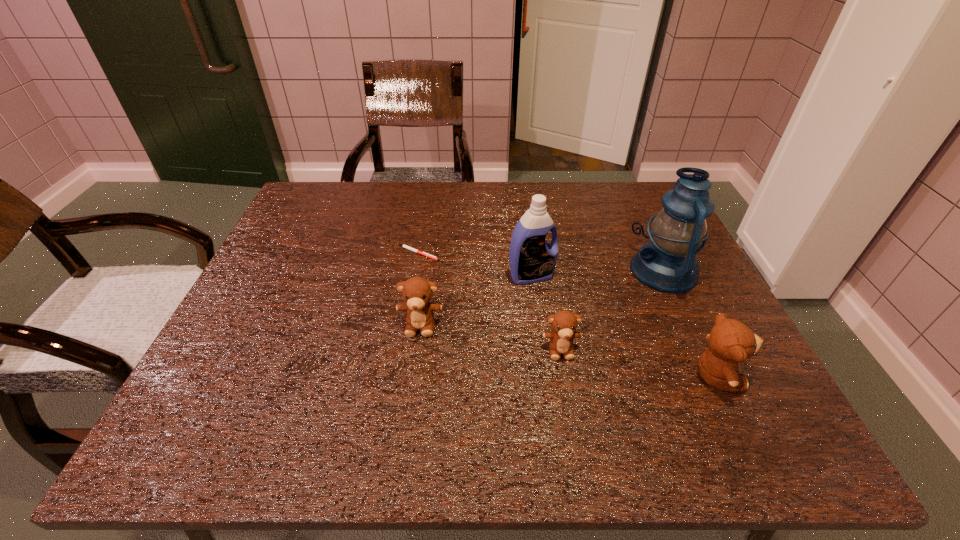
This screenshot has width=960, height=540. In order to click on vacant area between the fifth tallest object and the tallest teddy bear in this screenshot , I will do `click(638, 363)`.

What are the coordinates of `unoccupied position between the second tallest object and the second shortest teddy bear` in the screenshot? It's located at (476, 300).

This screenshot has height=540, width=960. I want to click on free spot between the second tallest object and the second shortest object, so click(546, 312).

You are a GUI agent. You are given a task and a screenshot of the screen. Output one action in this format:
    pyautogui.click(x=<x>, y=<y>)
    Task: Click on the object that is the fourth closest to the rightmost teddy bear
    
    Given the screenshot: What is the action you would take?
    pyautogui.click(x=416, y=291)

Find the location of `object that ranks as the fourth closest to the pen`. object that ranks as the fourth closest to the pen is located at coordinates (668, 263).

Locate which teddy bear ranks in proximity to the third shortest object. Please provide its 2D coordinates. Your answer should be formatted as a tuple, i.e. [(x, y)], where the tuple contains the x and y coordinates of a point satisfying the conditions above.

[(564, 323)]

Choose which teddy bear is the second nearest neighbor to the fourth tallest object. Please provide its 2D coordinates. Your answer should be formatted as a tuple, i.e. [(x, y)], where the tuple contains the x and y coordinates of a point satisfying the conditions above.

[(730, 341)]

Image resolution: width=960 pixels, height=540 pixels. I want to click on free space that satisfies the following two spatial constraints: 1. on the face of the tallest object; 2. on the face of the second tallest teddy bear, so click(x=689, y=325).

You are a GUI agent. You are given a task and a screenshot of the screen. Output one action in this format:
    pyautogui.click(x=<x>, y=<y>)
    Task: Click on the vacant area in the image that satisfies the following two spatial constraints: 1. on the clicker of the pen; 2. on the right side of the fifth shortest object
    
    Given the screenshot: What is the action you would take?
    pyautogui.click(x=415, y=275)

In order to click on vacant space that satisfies the following two spatial constraints: 1. on the clicker of the shortest object; 2. on the left side of the detergent in this screenshot , I will do `click(415, 275)`.